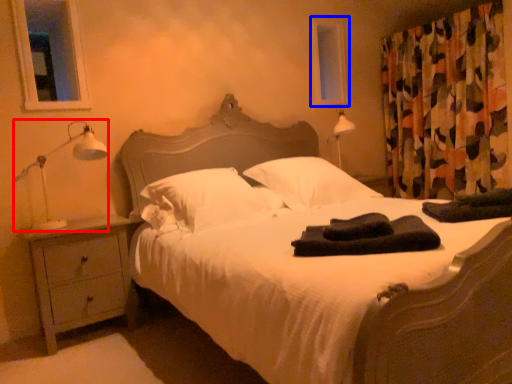
Question: Which object is further to the camera taking this photo, table lamp (highlighted by a red box) or window screen (highlighted by a blue box)?

Choices:
 (A) table lamp
 (B) window screen

Answer: (B)